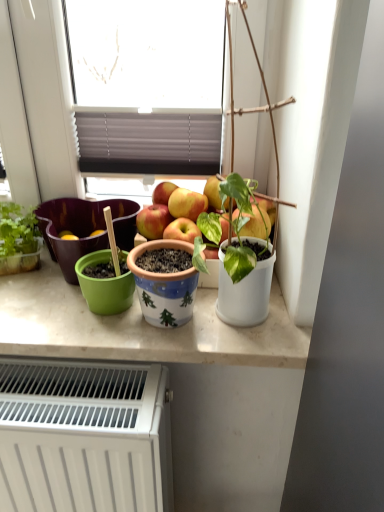
At what (x,y) coordinates should I click in order to perform the action: click on free space in front of green matte flowerpot at left, the 2th flowerpot positioned from the front. Please return your answer as a coordinate pair (x, y). This screenshot has width=384, height=512. Looking at the image, I should click on (57, 320).